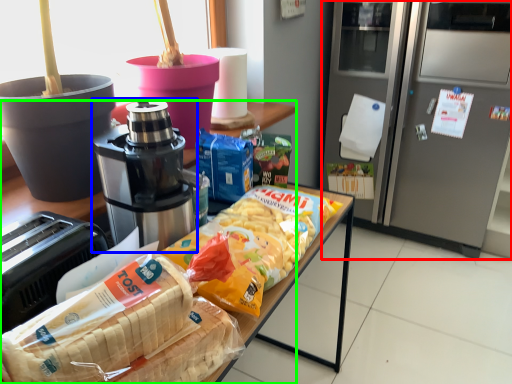
Question: Which is farther away from home appliance (highlighted by a red box)? coffee maker (highlighted by a blue box) or cabinetry (highlighted by a green box)?

Choices:
 (A) coffee maker
 (B) cabinetry

Answer: (B)